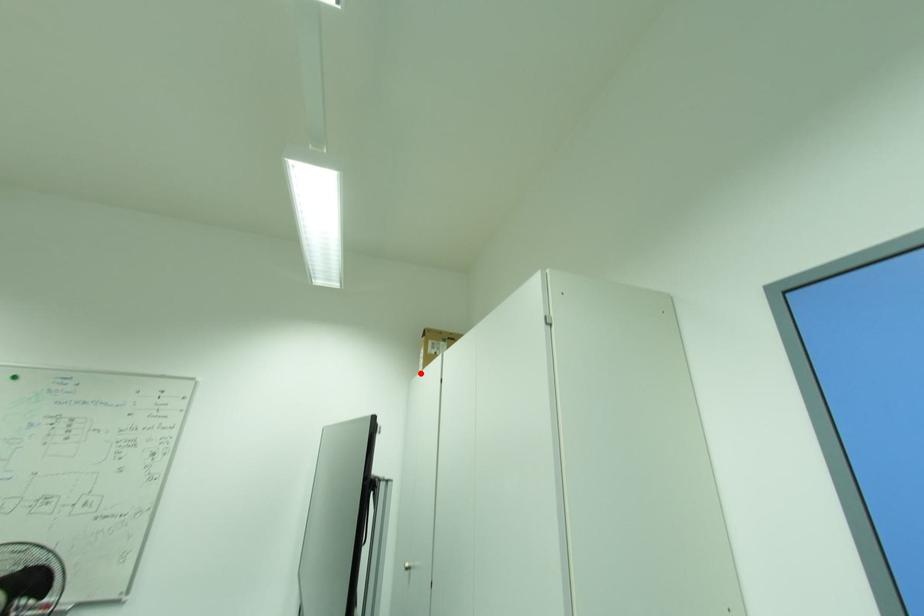
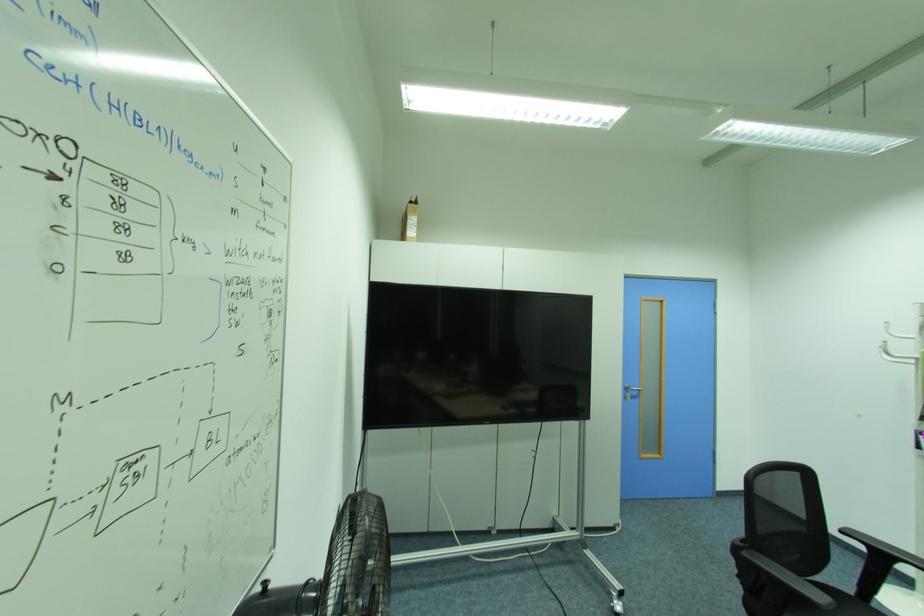
In the second image, find the point that corresponds to the highlighted location in the first image.

(407, 237)